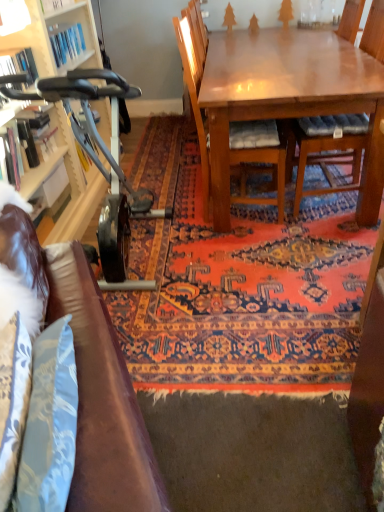
Question: Does wooden bookshelf at left turn towards matte white cabinet at left?

Choices:
 (A) no
 (B) yes

Answer: (A)

Question: Could matte white cabinet at left be considered to be inside wooden bookshelf at left?

Choices:
 (A) no
 (B) yes

Answer: (A)

Question: Does wooden bookshelf at left come behind matte white cabinet at left?

Choices:
 (A) no
 (B) yes

Answer: (B)

Question: From the image's perspective, is wooden bookshelf at left located above matte white cabinet at left?

Choices:
 (A) yes
 (B) no

Answer: (A)

Question: Can you confirm if wooden bookshelf at left is smaller than matte white cabinet at left?

Choices:
 (A) no
 (B) yes

Answer: (B)

Question: Is there a large distance between wooden bookshelf at left and matte white cabinet at left?

Choices:
 (A) no
 (B) yes

Answer: (A)

Question: Is wooden bookshelf at left not near metallic gray exercise bike at left?

Choices:
 (A) no
 (B) yes

Answer: (A)

Question: Is wooden bookshelf at left not inside metallic gray exercise bike at left?

Choices:
 (A) yes
 (B) no

Answer: (A)

Question: Can you confirm if wooden bookshelf at left is bigger than metallic gray exercise bike at left?

Choices:
 (A) no
 (B) yes

Answer: (A)

Question: From a real-world perspective, is wooden bookshelf at left on top of metallic gray exercise bike at left?

Choices:
 (A) yes
 (B) no

Answer: (A)

Question: Does wooden bookshelf at left appear on the right side of metallic gray exercise bike at left?

Choices:
 (A) no
 (B) yes

Answer: (A)

Question: From the image's perspective, would you say wooden bookshelf at left is shown under metallic gray exercise bike at left?

Choices:
 (A) no
 (B) yes

Answer: (A)

Question: From the image's perspective, is metallic gray exercise bike at left beneath wooden chair with cushion at center, which ranks as the 1th chair in right-to-left order?

Choices:
 (A) no
 (B) yes

Answer: (B)